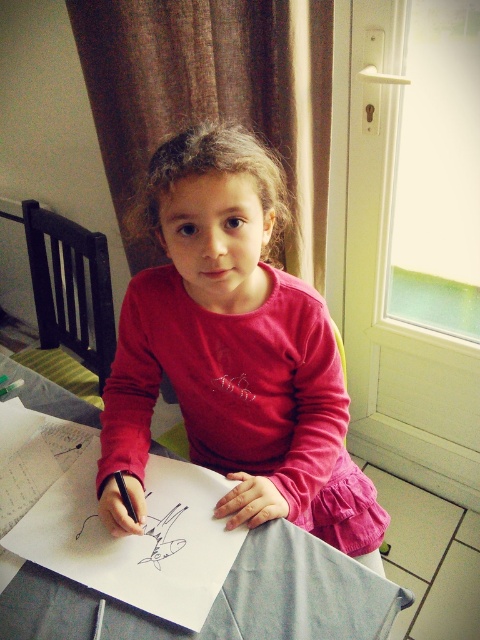
Is white paper at center shorter than black matte pencil at lower left?

No.

Can you confirm if white paper at center is bigger than black matte pencil at lower left?

Yes, white paper at center is bigger than black matte pencil at lower left.

Does point (212, 612) come closer to viewer compared to point (119, 480)?

Yes, point (212, 612) is closer to viewer.

The image size is (480, 640). Find the location of `white paper at center`. white paper at center is located at coordinates (279, 596).

Find the location of a particular element. The height and width of the screenshot is (640, 480). pink fabric shirt at center is located at coordinates (233, 353).

This screenshot has height=640, width=480. Identify the location of pink fabric shirt at center. point(233,353).

This screenshot has width=480, height=640. In order to click on pink fabric shirt at center in this screenshot , I will do `click(233, 353)`.

Between point (240, 436) and point (128, 496), which one is positioned behind?

Point (240, 436)

Locate an element on the screen. This screenshot has height=640, width=480. pink fabric shirt at center is located at coordinates (233, 353).

The width and height of the screenshot is (480, 640). I want to click on pink fabric shirt at center, so click(x=233, y=353).